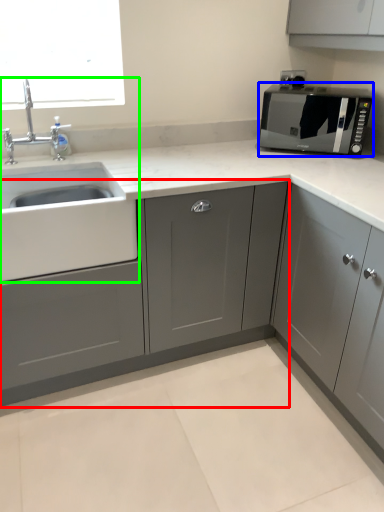
Question: Which is nearer to the cabinetry (highlighted by a red box)? microwave oven (highlighted by a blue box) or sink (highlighted by a green box).

Choices:
 (A) microwave oven
 (B) sink

Answer: (B)